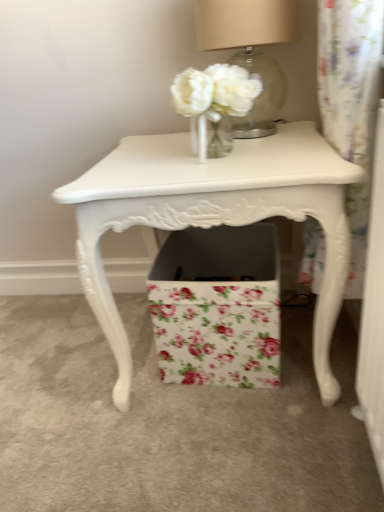
Question: From the image's perspective, is floral paper box at center above or below white painted wood table at center?

Choices:
 (A) above
 (B) below

Answer: (B)

Question: In terms of width, does floral paper box at center look wider or thinner when compared to white painted wood table at center?

Choices:
 (A) thin
 (B) wide

Answer: (A)

Question: Considering the real-world distances, which object is farthest from the floral paper box at center?

Choices:
 (A) white painted wood table at center
 (B) matte beige lampshade at upper center

Answer: (B)

Question: Estimate the real-world distances between objects in this image. Which object is farther from the floral paper box at center?

Choices:
 (A) matte beige lampshade at upper center
 (B) white painted wood table at center

Answer: (A)